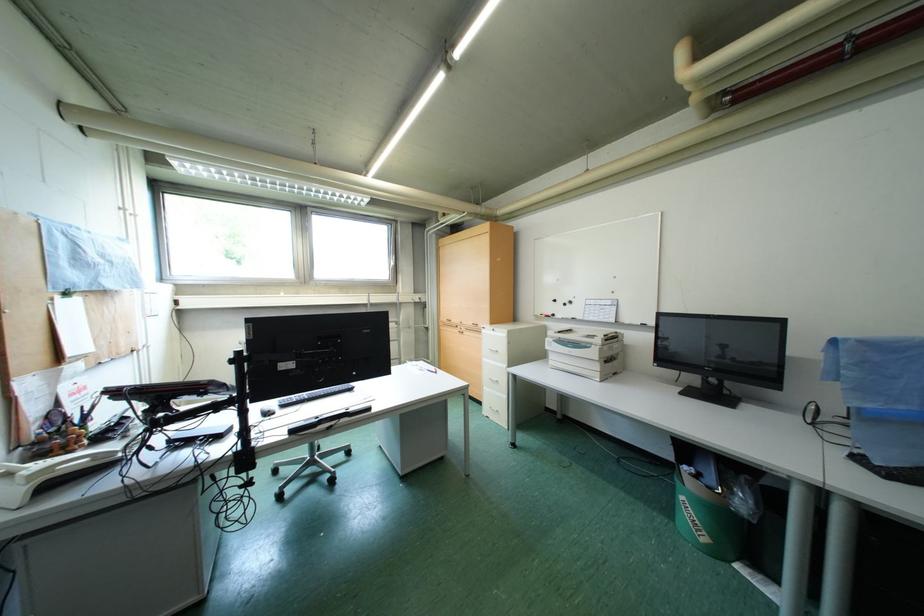
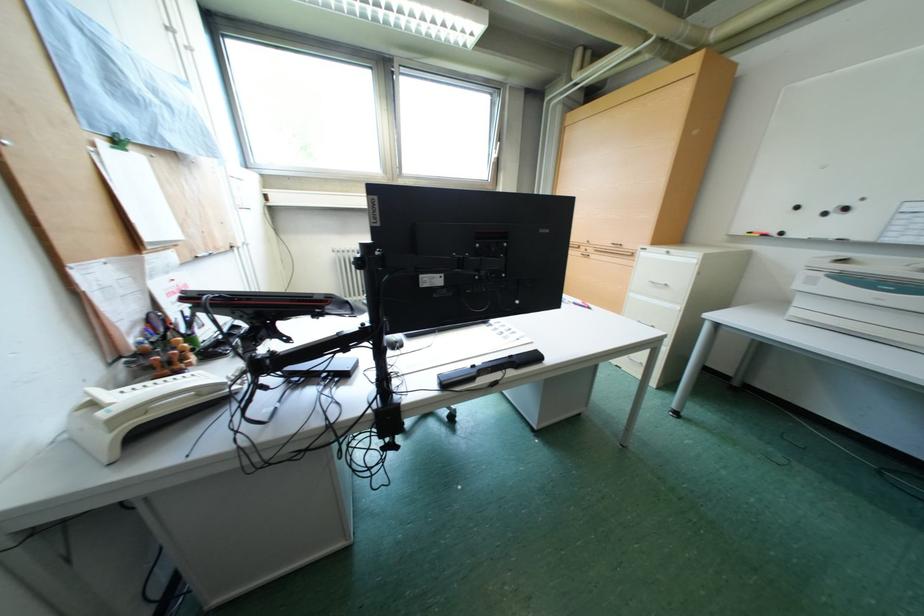
Question: Based on the continuous images, in which direction is the camera rotating? Reply with the corresponding letter.

Choices:
 (A) Left
 (B) Right
 (C) Up
 (D) Down

Answer: (D)